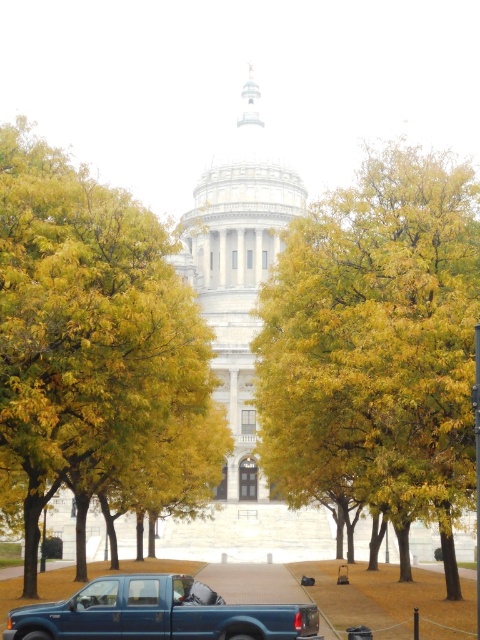
Is point (324, 483) farther from viewer compared to point (159, 584)?

Yes, it is.

Can you confirm if yellow leafy tree at center is positioned below metallic blue truck at lower left?

No, yellow leafy tree at center is not below metallic blue truck at lower left.

Is point (453, 321) positioned before point (305, 634)?

No, (453, 321) is behind (305, 634).

You are a GUI agent. You are given a task and a screenshot of the screen. Output one action in this format:
    pyautogui.click(x=<x>, y=<y>)
    Task: Click on the yellow leafy tree at center
    The height and width of the screenshot is (640, 480).
    Given the screenshot: What is the action you would take?
    pyautogui.click(x=376, y=348)

What do you see at coordinates (376, 348) in the screenshot?
I see `yellow leafy tree at center` at bounding box center [376, 348].

Which is behind, point (291, 291) or point (41, 385)?

Positioned behind is point (291, 291).

Which is in front, point (345, 429) or point (97, 346)?

Positioned in front is point (97, 346).

This screenshot has width=480, height=640. Identify the location of yellow leafy tree at center. (376, 348).

Describe the element at coordinates (95, 348) in the screenshot. I see `yellow/golden leaves at center` at that location.

Who is more distant from viewer, (x=67, y=182) or (x=166, y=598)?

The point (x=67, y=182) is behind.

Where is `yellow/golden leaves at center`? yellow/golden leaves at center is located at coordinates (95, 348).